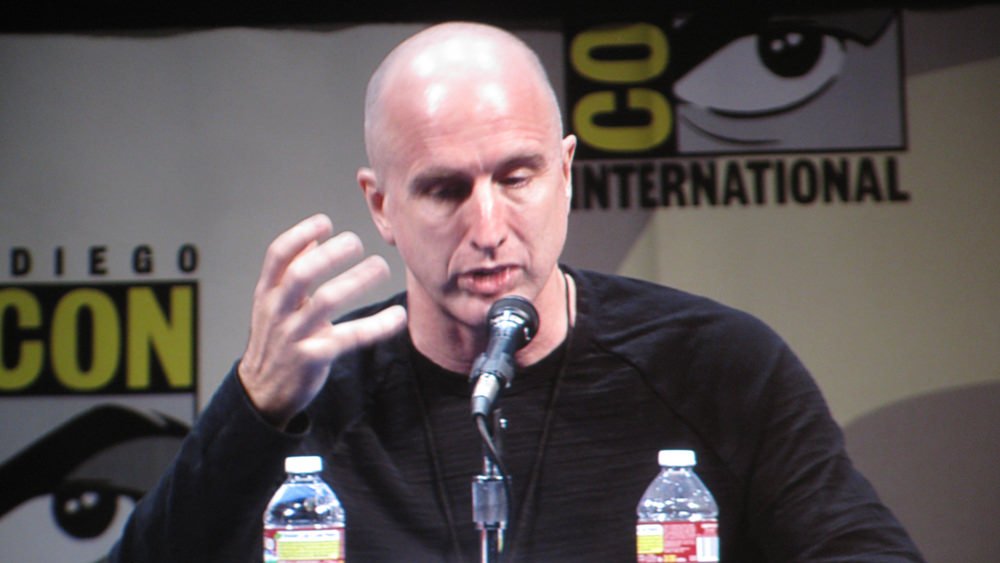
I want to click on bottle, so click(x=311, y=530), click(x=666, y=524).